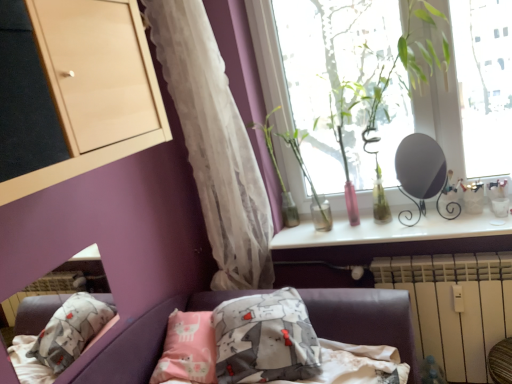
In order to face matte black mirror at upper right, should I rotate leftwards or rightwards?

To align with it, rotate right about 21.622°.

How much space does green glass vase at upper center, which is the 1th plant in left-to-right order, occupy vertically?

green glass vase at upper center, which is the 1th plant in left-to-right order, is 22.81 inches tall.

The width and height of the screenshot is (512, 384). Describe the element at coordinates (453, 112) in the screenshot. I see `transparent glass window at upper right` at that location.

Find the location of a particular element. The width and height of the screenshot is (512, 384). translucent white curtain at left is located at coordinates (215, 144).

Is white plastic radiator at lower right taller or shorter than transparent glass window at upper right?

Clearly, white plastic radiator at lower right is shorter compared to transparent glass window at upper right.

Does white plastic radiator at lower right have a larger size compared to transparent glass window at upper right?

Correct, white plastic radiator at lower right is larger in size than transparent glass window at upper right.

Consider the image. Is white plastic radiator at lower right located outside transparent glass window at upper right?

Yes, white plastic radiator at lower right is located beyond the bounds of transparent glass window at upper right.

From a real-world perspective, which object stands above the other?

transparent glass window at upper right.

Which is more to the left, transparent glass window at upper right or matte black mirror at upper right?

From the viewer's perspective, transparent glass window at upper right appears more on the left side.

In the scene shown: From a real-world perspective, which is physically below, transparent glass window at upper right or matte black mirror at upper right?

→ In real-world perspective, matte black mirror at upper right is lower.

Considering the sizes of objects transparent glass window at upper right and matte black mirror at upper right in the image provided, who is smaller, transparent glass window at upper right or matte black mirror at upper right?

matte black mirror at upper right is smaller.

In the image, is matte black mirror at upper right positioned in front of or behind transparent glass window at upper right?

matte black mirror at upper right is behind transparent glass window at upper right.

Is matte black mirror at upper right thinner than transparent glass window at upper right?

No.

I want to click on window in front of the matte black mirror at upper right, so click(x=453, y=112).

How different are the orientations of transparent glass window at upper right and green glass vase at upper center, arranged as the 2th plant when viewed from the left, in degrees?

transparent glass window at upper right and green glass vase at upper center, arranged as the 2th plant when viewed from the left, are facing 2.52 degrees away from each other.

Identify the location of window above the green glass vase at upper center, which appears as the first plant when viewed from the right (from a real-world perspective). (453, 112).

From the image's perspective, relative to green glass vase at upper center, arranged as the 2th plant when viewed from the left, is transparent glass window at upper right above or below?

Based on their image positions, transparent glass window at upper right is located above green glass vase at upper center, arranged as the 2th plant when viewed from the left.

Considering the positions of points (401, 130) and (305, 173), is point (401, 130) closer to camera compared to point (305, 173)?

Yes, point (401, 130) is in front of point (305, 173).

Is matte black mirror at upper right not close to translucent white curtain at left?

No, there isn't a large distance between matte black mirror at upper right and translucent white curtain at left.

Locate an element on the screen. The image size is (512, 384). mirror lying on the right of translucent white curtain at left is located at coordinates (419, 171).

Which object is positioned more to the right, matte black mirror at upper right or translucent white curtain at left?

matte black mirror at upper right.

Is white plastic radiator at lower right positioned beyond the bounds of matte black mirror at upper right?

Yes, white plastic radiator at lower right is outside of matte black mirror at upper right.

In the image, is white plastic radiator at lower right positioned in front of or behind matte black mirror at upper right?

Visually, white plastic radiator at lower right is located in front of matte black mirror at upper right.

Considering the sizes of objects white plastic radiator at lower right and matte black mirror at upper right in the image provided, who is thinner, white plastic radiator at lower right or matte black mirror at upper right?

matte black mirror at upper right.

Can you confirm if white plastic radiator at lower right is shorter than green glass vase at upper center, arranged as the 2th plant when viewed from the left?

Incorrect, the height of white plastic radiator at lower right does not fall short of that of green glass vase at upper center, arranged as the 2th plant when viewed from the left.

Considering the points (420, 274) and (323, 216), which point is behind, point (420, 274) or point (323, 216)?

The point (323, 216) is farther from the camera.

Is white plastic radiator at lower right wider or thinner than green glass vase at upper center, arranged as the 2th plant when viewed from the left?

Clearly, white plastic radiator at lower right has less width compared to green glass vase at upper center, arranged as the 2th plant when viewed from the left.

From the image's perspective, would you say white plastic radiator at lower right is shown under green glass vase at upper center, arranged as the 2th plant when viewed from the left?

Yes, from the image's perspective, white plastic radiator at lower right is below green glass vase at upper center, arranged as the 2th plant when viewed from the left.

The height and width of the screenshot is (384, 512). Identify the location of radiator behind the transparent glass window at upper right. click(453, 306).

Locate an element on the screen. This screenshot has width=512, height=384. mirror below the transparent glass window at upper right (from a real-world perspective) is located at coordinates (419, 171).

Which object lies further to the anchor point white plastic radiator at lower right, transparent glass window at upper right or matte black mirror at upper right?

Based on the image, transparent glass window at upper right appears to be further to white plastic radiator at lower right.

When comparing their distances from translucent white curtain at left, does matte black mirror at upper right or transparent glass window at upper right seem closer?

Among the two, transparent glass window at upper right is located nearer to translucent white curtain at left.

From the image, which object appears to be farther from translucent white curtain at left, green glass vase at upper center, arranged as the 2th plant when viewed from the left, or transparent glass window at upper right?

Based on the image, transparent glass window at upper right appears to be further to translucent white curtain at left.

Looking at the image, which one is located closer to matte black mirror at upper right, green glass vase at upper center, which is the second plant in right-to-left order, or transparent glass window at upper right?

Based on the image, transparent glass window at upper right appears to be nearer to matte black mirror at upper right.

Based on the photo, based on their spatial positions, is transparent glass window at upper right or green glass vase at upper center, which appears as the first plant when viewed from the right, closer to translucent white curtain at left?

green glass vase at upper center, which appears as the first plant when viewed from the right.

Considering their positions, is green glass vase at upper center, which is the second plant in right-to-left order, positioned closer to transparent glass window at upper right than translucent white curtain at left?

green glass vase at upper center, which is the second plant in right-to-left order, is positioned closer to the anchor transparent glass window at upper right.

Estimate the real-world distances between objects in this image. Which object is further from transparent glass window at upper right, translucent white curtain at left or green glass vase at upper center, which is the 1th plant in left-to-right order?

translucent white curtain at left.

Based on their spatial positions, is white plastic radiator at lower right or matte black mirror at upper right closer to translucent white curtain at left?

The object closer to translucent white curtain at left is matte black mirror at upper right.

This screenshot has height=384, width=512. In order to click on mirror between transparent glass window at upper right and white plastic radiator at lower right from top to bottom in this screenshot , I will do `click(419, 171)`.

Locate an element on the screen. This screenshot has width=512, height=384. mirror that lies between green glass vase at upper center, which is the second plant in right-to-left order, and white plastic radiator at lower right from top to bottom is located at coordinates (419, 171).

At what (x,y) coordinates should I click in order to perform the action: click on window between green glass vase at upper center, arranged as the 2th plant when viewed from the left, and matte black mirror at upper right from left to right. Please return your answer as a coordinate pair (x, y). The height and width of the screenshot is (384, 512). Looking at the image, I should click on (453, 112).

What are the coordinates of `plant between green glass vase at upper center, which is the 1th plant in left-to-right order, and transparent glass window at upper right, in the horizontal direction` in the screenshot? It's located at (307, 175).